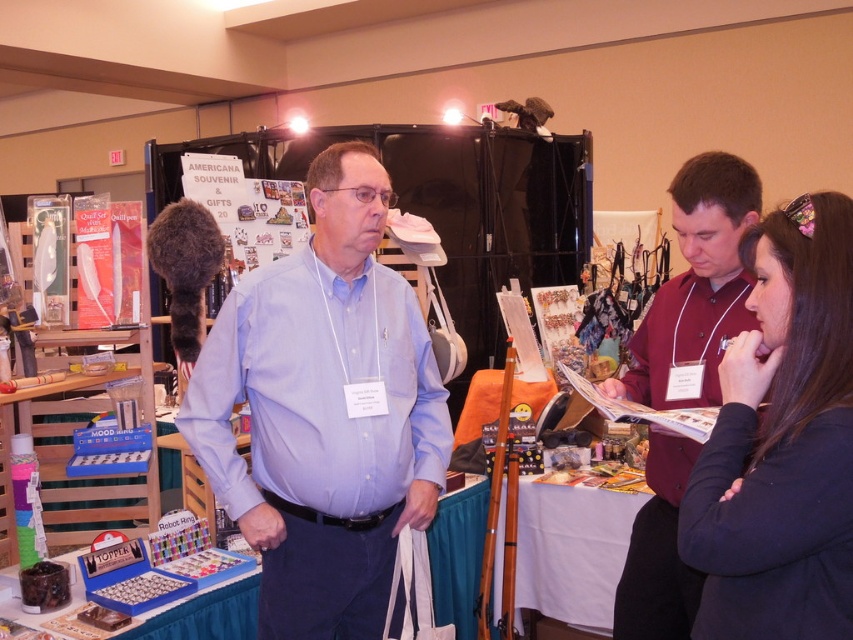
How distant is dark blue sweater at center from maroon button-up shirt at center?

dark blue sweater at center and maroon button-up shirt at center are 14.56 inches apart.

Is dark blue sweater at center behind maroon button-up shirt at center?

That is False.

Identify the location of dark blue sweater at center. (781, 442).

Identify the location of dark blue sweater at center. This screenshot has width=853, height=640. (781, 442).

Who is positioned more to the right, light blue shirt at center or dark blue sweater at center?

From the viewer's perspective, dark blue sweater at center appears more on the right side.

Looking at this image, between light blue shirt at center and dark blue sweater at center, which one has more height?

light blue shirt at center is taller.

You are a GUI agent. You are given a task and a screenshot of the screen. Output one action in this format:
    pyautogui.click(x=<x>, y=<y>)
    Task: Click on the light blue shirt at center
    The image size is (853, 640).
    Given the screenshot: What is the action you would take?
    coord(323,412)

This screenshot has width=853, height=640. I want to click on light blue shirt at center, so click(x=323, y=412).

Is light blue shirt at center to the left of maroon button-up shirt at center from the viewer's perspective?

Yes, light blue shirt at center is to the left of maroon button-up shirt at center.

Does light blue shirt at center appear on the right side of maroon button-up shirt at center?

Incorrect, light blue shirt at center is not on the right side of maroon button-up shirt at center.

Does point (296, 282) come in front of point (752, 216)?

No, it is behind (752, 216).

The width and height of the screenshot is (853, 640). Identify the location of light blue shirt at center. (323, 412).